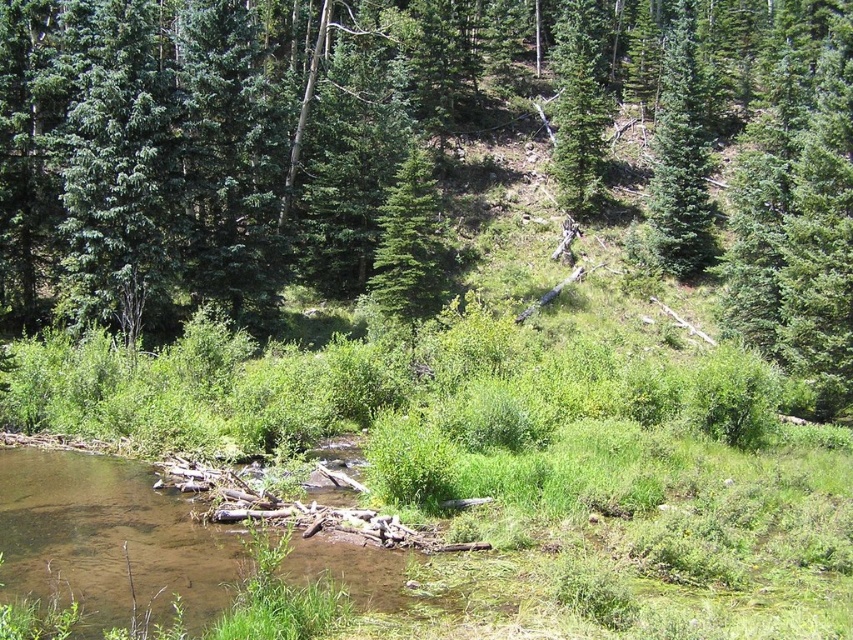
Who is taller, green fir tree at upper right or green matte tree at center?

green fir tree at upper right

Who is higher up, green fir tree at upper right or green matte tree at center?

Positioned higher is green fir tree at upper right.

You are a GUI agent. You are given a task and a screenshot of the screen. Output one action in this format:
    pyautogui.click(x=<x>, y=<y>)
    Task: Click on the green fir tree at upper right
    
    Given the screenshot: What is the action you would take?
    pyautogui.click(x=680, y=157)

Is brown muddy water at lower left positioned in front of green matte tree at upper center?

Yes, it is.

Is brown muddy water at lower left wider than green matte tree at upper center?

Correct, the width of brown muddy water at lower left exceeds that of green matte tree at upper center.

What do you see at coordinates (108, 538) in the screenshot? I see `brown muddy water at lower left` at bounding box center [108, 538].

Where is `brown muddy water at lower left`? The image size is (853, 640). brown muddy water at lower left is located at coordinates (108, 538).

Does green matte tree at center appear over green matte tree at upper center?

No.

Can you confirm if green matte tree at center is shorter than green matte tree at upper center?

Indeed, green matte tree at center has a lesser height compared to green matte tree at upper center.

Between point (434, 262) and point (589, 209), which one is positioned behind?

The point (589, 209) is more distant.

Where is `green matte tree at center`? This screenshot has height=640, width=853. green matte tree at center is located at coordinates (410, 250).